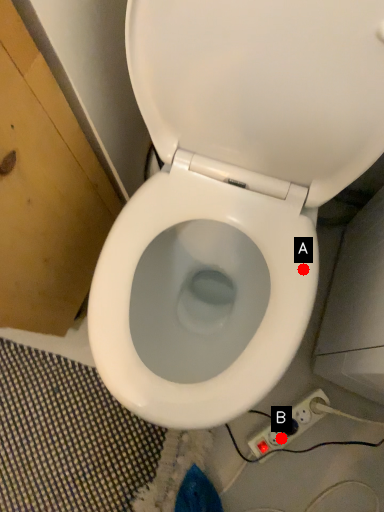
Question: Two points are circled on the image, labeled by A and B beside each circle. Among these points, which one is nearest to the camera?

Choices:
 (A) A is closer
 (B) B is closer

Answer: (A)